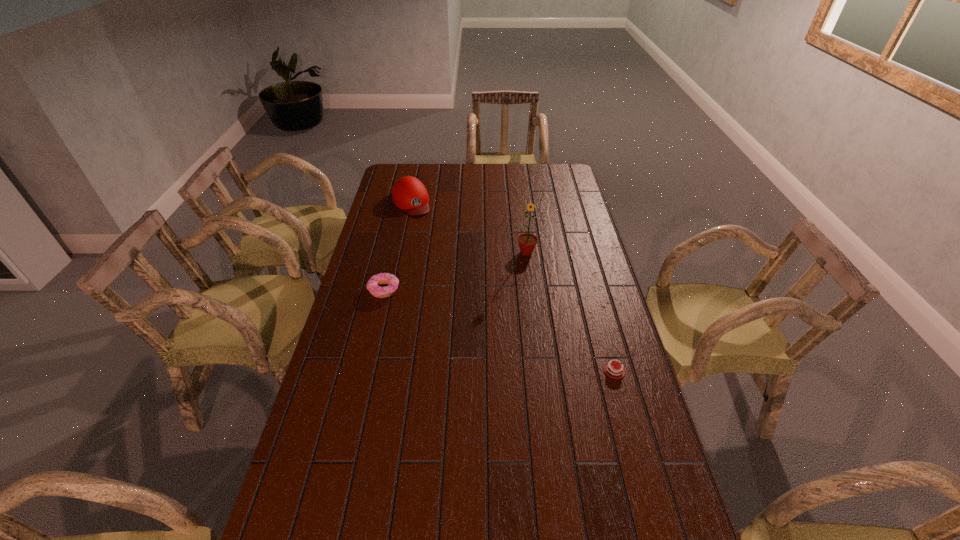
This screenshot has width=960, height=540. Identify the location of the third farthest object. coord(375,290).

Find the location of a particular element. The image size is (960, 540). doughnut is located at coordinates (375, 290).

Image resolution: width=960 pixels, height=540 pixels. I want to click on the rightmost object, so click(609, 368).

The image size is (960, 540). I want to click on chocolate cake, so click(x=609, y=368).

Image resolution: width=960 pixels, height=540 pixels. What are the coordinates of `the farthest object` in the screenshot? It's located at (409, 194).

I want to click on baseball cap, so click(x=409, y=194).

This screenshot has height=540, width=960. Find the location of `the tallest object`. the tallest object is located at coordinates (527, 242).

You are a GUI agent. You are given a task and a screenshot of the screen. Output one action in this format:
    pyautogui.click(x=<x>, y=<y>)
    Task: Click on the second farthest object
    
    Given the screenshot: What is the action you would take?
    pyautogui.click(x=527, y=242)

You are a GUI agent. You are given a task and a screenshot of the screen. Output one action in this format:
    pyautogui.click(x=<x>, y=<y>)
    Task: Click on the free space located 0.070m on the front of the doughnut
    This screenshot has height=540, width=960.
    Given the screenshot: What is the action you would take?
    pyautogui.click(x=377, y=316)

This screenshot has width=960, height=540. In order to click on free location located on the back of the rightmost object in this screenshot , I will do `click(587, 268)`.